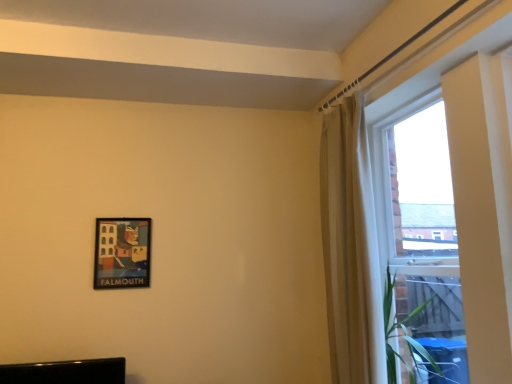
Question: Is transparent glass window at right shorter than matte black picture frame at lower left?

Choices:
 (A) no
 (B) yes

Answer: (A)

Question: Are transparent glass window at right and matte black picture frame at lower left located far from each other?

Choices:
 (A) yes
 (B) no

Answer: (A)

Question: Is transparent glass window at right positioned with its back to matte black picture frame at lower left?

Choices:
 (A) no
 (B) yes

Answer: (A)

Question: Would you say transparent glass window at right is outside matte black picture frame at lower left?

Choices:
 (A) yes
 (B) no

Answer: (A)

Question: From a real-world perspective, is transparent glass window at right physically below matte black picture frame at lower left?

Choices:
 (A) yes
 (B) no

Answer: (B)

Question: From a real-world perspective, is transparent glass window at right located higher than matte black picture frame at lower left?

Choices:
 (A) no
 (B) yes

Answer: (B)

Question: From a real-world perspective, is matte black picture frame at lower left on beige fabric curtain at upper right?

Choices:
 (A) yes
 (B) no

Answer: (B)

Question: Is the surface of matte black picture frame at lower left in direct contact with beige fabric curtain at upper right?

Choices:
 (A) no
 (B) yes

Answer: (A)

Question: Is matte black picture frame at lower left positioned before beige fabric curtain at upper right?

Choices:
 (A) yes
 (B) no

Answer: (B)

Question: Would you say matte black picture frame at lower left is a long distance from beige fabric curtain at upper right?

Choices:
 (A) no
 (B) yes

Answer: (B)

Question: Would you say beige fabric curtain at upper right is part of matte black picture frame at lower left's contents?

Choices:
 (A) yes
 (B) no

Answer: (B)

Question: Is matte black picture frame at lower left outside beige fabric curtain at upper right?

Choices:
 (A) yes
 (B) no

Answer: (A)

Question: Is the position of beige fabric curtain at upper right less distant than that of transparent glass window at right?

Choices:
 (A) yes
 (B) no

Answer: (B)